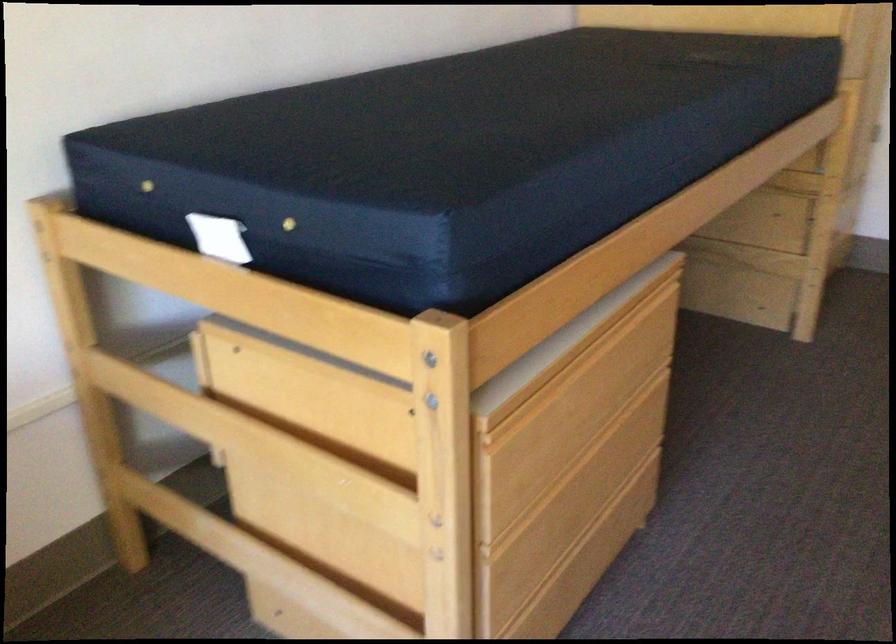
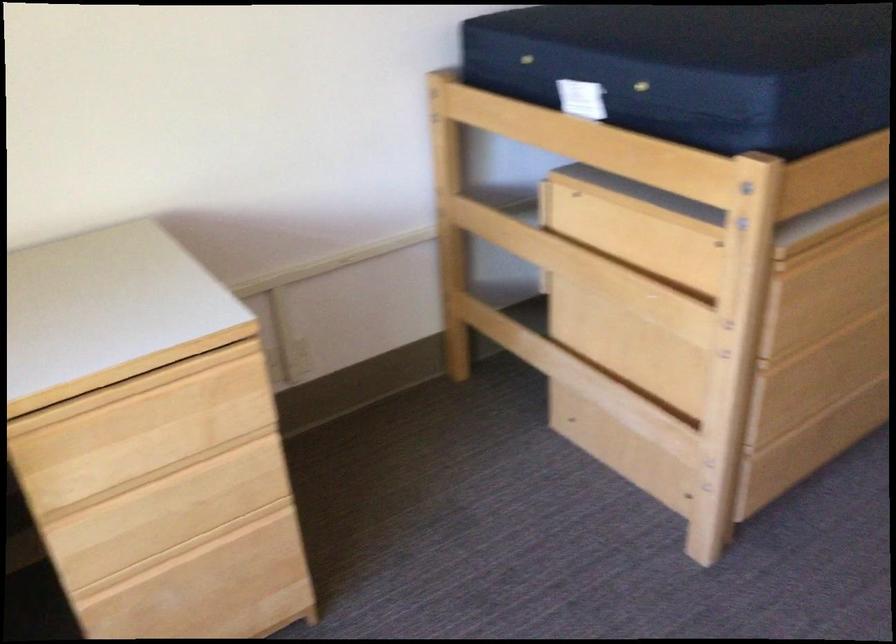
Where in the second image is the point corresponding to (x=538, y=393) from the first image?

(828, 240)